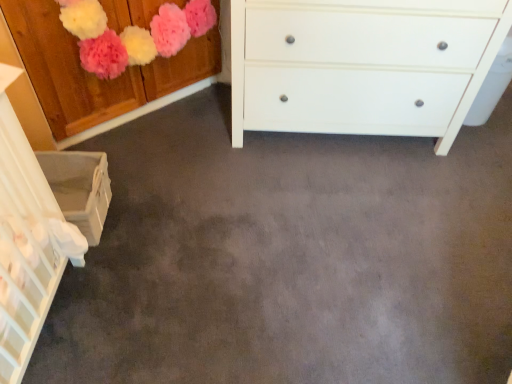
Identify the location of free point behind white woven basket at lower left, which is the 2th cabinetry from top to bottom. This screenshot has height=384, width=512. (123, 150).